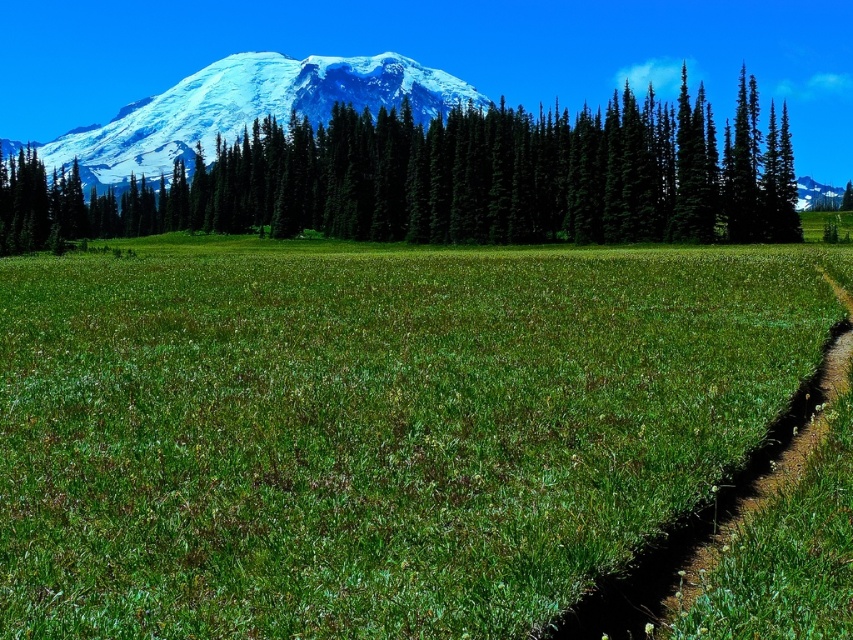
You are planning to take a photo of the green matte trees at upper center and the brown dirt path at lower right. Which object will occupy more space in your photo?

The green matte trees at upper center will occupy more space in the photo because their width is larger than the brown dirt path at lower right.

You are a hiker starting at the brown dirt path at lower right and want to reach the snowy white mountain at upper left. Which direction should you head to first?

The brown dirt path at lower right is to the right of snowy white mountain at upper left, so you should head to the left to move towards the snowy white mountain at upper left.